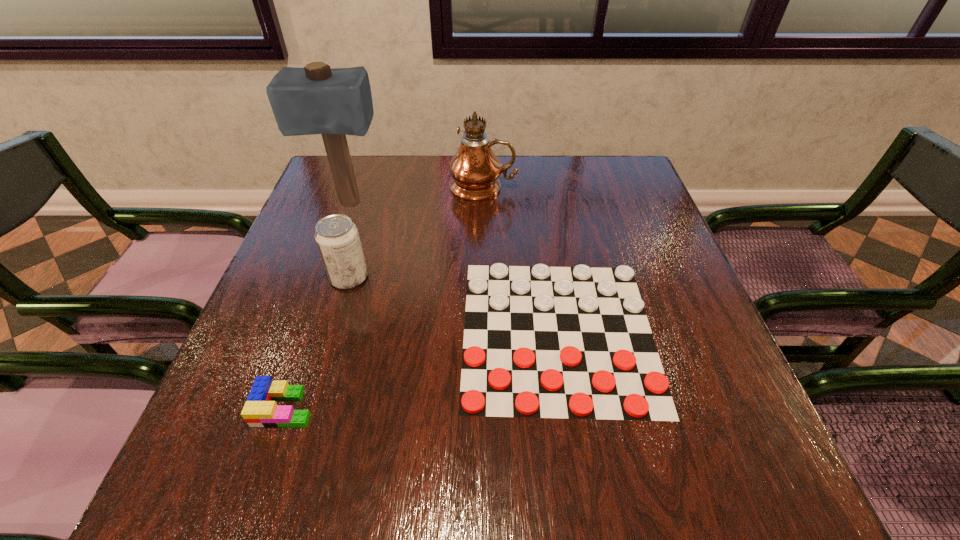
What are the coordinates of `oil lamp` in the screenshot? It's located at (475, 169).

You are a GUI agent. You are given a task and a screenshot of the screen. Output one action in this format:
    pyautogui.click(x=<x>, y=<y>)
    Task: Click on the mallet
    The width and height of the screenshot is (960, 540).
    Given the screenshot: What is the action you would take?
    pyautogui.click(x=316, y=99)

You are a GUI agent. You are given a task and a screenshot of the screen. Output one action in this format:
    pyautogui.click(x=<x>, y=<y>)
    Task: Click on the third tallest object
    
    Given the screenshot: What is the action you would take?
    pyautogui.click(x=337, y=237)

Where is `the second shortest object`? Image resolution: width=960 pixels, height=540 pixels. the second shortest object is located at coordinates (260, 410).

You are a GUI agent. You are given a task and a screenshot of the screen. Output one action in this format:
    pyautogui.click(x=<x>, y=<y>)
    Task: Click on the checkerboard
    Image resolution: width=960 pixels, height=540 pixels.
    Given the screenshot: What is the action you would take?
    pyautogui.click(x=576, y=343)

Where is `vacant region located on the right of the oil lamp`? This screenshot has height=540, width=960. vacant region located on the right of the oil lamp is located at coordinates (577, 187).

Locate an element on the screen. The height and width of the screenshot is (540, 960). vacant space positioned on the front of the mallet is located at coordinates (324, 275).

The image size is (960, 540). Find the location of `vacant space located on the front of the soda can`. vacant space located on the front of the soda can is located at coordinates (x=302, y=433).

Locate an element on the screen. The image size is (960, 540). vacant space situated 0.090m on the right of the second shortest object is located at coordinates (365, 408).

This screenshot has height=540, width=960. What are the coordinates of `vacant area situated on the back of the checkerboard` in the screenshot? It's located at (534, 177).